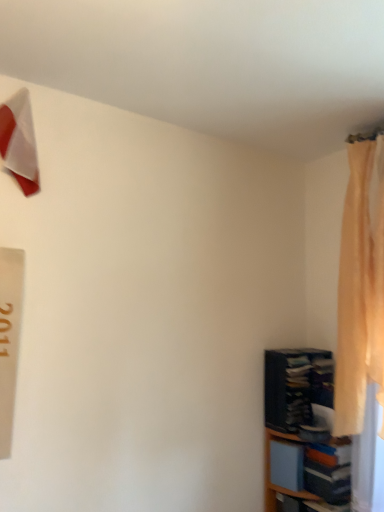
Question: Is silky beige curtain at right completely or partially inside wooden bookshelf at lower right?

Choices:
 (A) yes
 (B) no

Answer: (B)

Question: Is wooden bookshelf at lower right smaller than silky beige curtain at right?

Choices:
 (A) yes
 (B) no

Answer: (A)

Question: Is wooden bookshelf at lower right not within silky beige curtain at right?

Choices:
 (A) yes
 (B) no

Answer: (A)

Question: From the image's perspective, is wooden bookshelf at lower right located beneath silky beige curtain at right?

Choices:
 (A) no
 (B) yes

Answer: (B)

Question: Is wooden bookshelf at lower right further to the viewer compared to silky beige curtain at right?

Choices:
 (A) yes
 (B) no

Answer: (A)

Question: Considering the relative sizes of wooden bookshelf at lower right and silky beige curtain at right in the image provided, is wooden bookshelf at lower right shorter than silky beige curtain at right?

Choices:
 (A) no
 (B) yes

Answer: (B)

Question: Is dark blue fabric bookshelf at lower right with white glossy triangle at upper left?

Choices:
 (A) no
 (B) yes

Answer: (A)

Question: From a real-world perspective, does dark blue fabric bookshelf at lower right sit lower than white glossy triangle at upper left?

Choices:
 (A) no
 (B) yes

Answer: (B)

Question: Can you confirm if dark blue fabric bookshelf at lower right is positioned to the right of white glossy triangle at upper left?

Choices:
 (A) yes
 (B) no

Answer: (A)

Question: Can you confirm if dark blue fabric bookshelf at lower right is smaller than white glossy triangle at upper left?

Choices:
 (A) no
 (B) yes

Answer: (A)

Question: Can you confirm if dark blue fabric bookshelf at lower right is thinner than white glossy triangle at upper left?

Choices:
 (A) no
 (B) yes

Answer: (A)

Question: Does dark blue fabric bookshelf at lower right have a greater height compared to white glossy triangle at upper left?

Choices:
 (A) no
 (B) yes

Answer: (A)

Question: Can you confirm if silky beige curtain at right is wider than white glossy triangle at upper left?

Choices:
 (A) yes
 (B) no

Answer: (A)